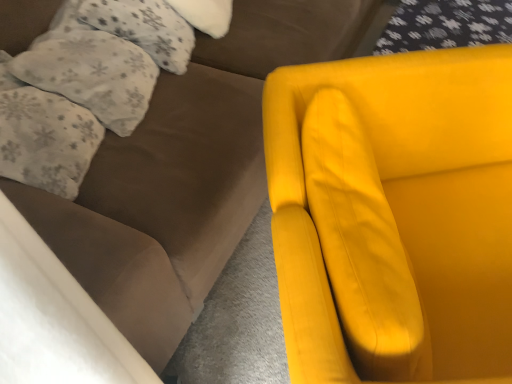
Question: In terms of height, does matte yellow armchair at right look taller or shorter compared to fluffy white pillow at upper left, which ranks as the 1th pillow in bottom-to-top order?

Choices:
 (A) tall
 (B) short

Answer: (A)

Question: From a real-world perspective, is matte yellow armchair at right above or below fluffy white pillow at upper left, the third pillow from the top?

Choices:
 (A) below
 (B) above

Answer: (A)

Question: Estimate the real-world distances between objects in this image. Which object is closer to the fluffy white pillow at upper left, the third pillow from the top?

Choices:
 (A) matte yellow armchair at right
 (B) white fluffy pillow at upper left, the second pillow positioned from the top
 (C) fluffy white pillow at upper left, which is the first pillow from top to bottom

Answer: (B)

Question: Estimate the real-world distances between objects in this image. Which object is closer to the white fluffy pillow at upper left, the second pillow positioned from the top?

Choices:
 (A) fluffy white pillow at upper left, which is the first pillow from top to bottom
 (B) fluffy white pillow at upper left, which ranks as the 1th pillow in bottom-to-top order
 (C) matte yellow armchair at right

Answer: (B)